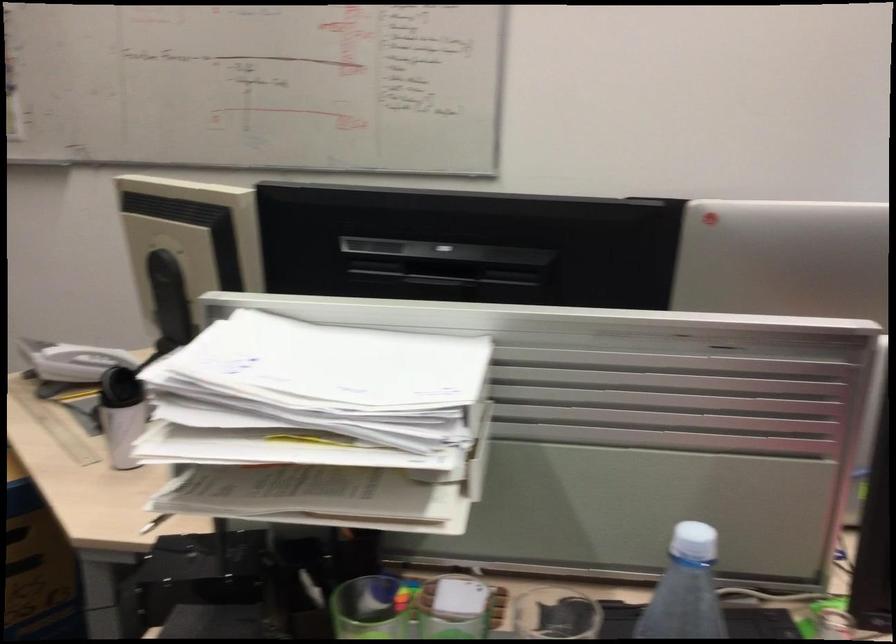
In order to click on plastic water bottle in this screenshot , I will do `click(685, 589)`.